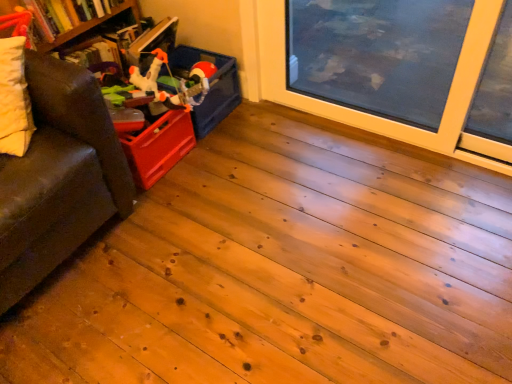
This screenshot has width=512, height=384. What do you see at coordinates (72, 24) in the screenshot?
I see `wooden bookshelf at left` at bounding box center [72, 24].

Identify the location of matte plastic storage box at upper left. The width and height of the screenshot is (512, 384). (210, 86).

Based on the photo, which object is further away from the camera, matte plastic toy at upper left or brown leather couch at left?

matte plastic toy at upper left is further away from the camera.

The image size is (512, 384). What are the coordinates of `studio couch above the matte plastic toy at upper left (from a real-world perspective)` in the screenshot? It's located at (58, 177).

Considering the sizes of matte plastic toy at upper left and brown leather couch at left in the image, is matte plastic toy at upper left bigger or smaller than brown leather couch at left?

Considering their sizes, matte plastic toy at upper left takes up less space than brown leather couch at left.

From a real-world perspective, is matte plastic toy at upper left physically located above or below brown leather couch at left?

matte plastic toy at upper left is below brown leather couch at left.

Would you say matte plastic storage box at upper left is part of brown leather couch at left's contents?

Definitely not — matte plastic storage box at upper left is not inside brown leather couch at left.

Is brown leather couch at left smaller than matte plastic storage box at upper left?

No, brown leather couch at left is not smaller than matte plastic storage box at upper left.

Does brown leather couch at left have a lesser width compared to matte plastic storage box at upper left?

No.

Is brown leather couch at left in front of matte plastic storage box at upper left?

Yes, it is in front of matte plastic storage box at upper left.

Is matte plastic storage box at upper left facing away from wooden bookshelf at left?

Yes, matte plastic storage box at upper left's orientation is away from wooden bookshelf at left.

Which of these two, matte plastic storage box at upper left or wooden bookshelf at left, is wider?

Wider between the two is wooden bookshelf at left.

From the image's perspective, is matte plastic storage box at upper left on top of wooden bookshelf at left?

Incorrect, from the image's perspective, matte plastic storage box at upper left is lower than wooden bookshelf at left.

How different are the orientations of matte plastic storage box at upper left and hardcover book at upper left in degrees?

0.992 degrees separate the facing orientations of matte plastic storage box at upper left and hardcover book at upper left.

Consider the image. Which object is positioned more to the right, matte plastic storage box at upper left or hardcover book at upper left?

matte plastic storage box at upper left is more to the right.

Is matte plastic storage box at upper left looking in the opposite direction of hardcover book at upper left?

No, hardcover book at upper left is not at the back of matte plastic storage box at upper left.

Which of these two, matte plastic storage box at upper left or hardcover book at upper left, is bigger?

hardcover book at upper left.

Is matte plastic toy at upper left inside the boundaries of matte plastic storage box at upper left, or outside?

matte plastic toy at upper left cannot be found inside matte plastic storage box at upper left.

Who is smaller, matte plastic toy at upper left or matte plastic storage box at upper left?

With smaller size is matte plastic storage box at upper left.

Can you confirm if matte plastic toy at upper left is wider than matte plastic storage box at upper left?

In fact, matte plastic toy at upper left might be narrower than matte plastic storage box at upper left.

Is there a large distance between matte plastic toy at upper left and matte plastic storage box at upper left?

That's not correct — matte plastic toy at upper left is a little close to matte plastic storage box at upper left.

Which is behind, point (34, 36) or point (30, 271)?

The point (34, 36) is more distant.

Looking at this image, between wooden bookshelf at left and brown leather couch at left, which one appears on the left side from the viewer's perspective?

Positioned to the left is wooden bookshelf at left.

From a real-world perspective, which object stands above the other?

In real-world perspective, brown leather couch at left is above.

From the image's perspective, between wooden bookshelf at left and brown leather couch at left, who is located below?

brown leather couch at left appears lower in the image.

Locate an element on the screen. This screenshot has height=384, width=512. storage box that is behind the wooden bookshelf at left is located at coordinates (210, 86).

Can you confirm if wooden bookshelf at left is bigger than matte plastic storage box at upper left?

Yes, wooden bookshelf at left is bigger than matte plastic storage box at upper left.

Based on the photo, measure the distance between wooden bookshelf at left and matte plastic storage box at upper left.

The distance of wooden bookshelf at left from matte plastic storage box at upper left is 43.45 centimeters.

From the picture: Considering the sizes of wooden bookshelf at left and matte plastic storage box at upper left in the image, is wooden bookshelf at left taller or shorter than matte plastic storage box at upper left?

In the image, wooden bookshelf at left appears to be taller than matte plastic storage box at upper left.

I want to click on toy on the right of the brown leather couch at left, so click(165, 83).

Locate an element on the screen. The height and width of the screenshot is (384, 512). studio couch above the matte plastic storage box at upper left (from a real-world perspective) is located at coordinates (58, 177).

From the image, which object appears to be nearer to matte plastic storage box at upper left, brown leather couch at left or wooden bookshelf at left?

Among the two, wooden bookshelf at left is located nearer to matte plastic storage box at upper left.

Which object lies nearer to the anchor point brown leather couch at left, matte plastic storage box at upper left or wooden bookshelf at left?

Among the two, matte plastic storage box at upper left is located nearer to brown leather couch at left.

Looking at the image, which one is located closer to matte plastic toy at upper left, wooden bookshelf at left or matte plastic storage box at upper left?

Among the two, matte plastic storage box at upper left is located nearer to matte plastic toy at upper left.

In the scene shown: Which object lies nearer to the anchor point matte plastic toy at upper left, matte plastic storage box at upper left or hardcover book at upper left?

matte plastic storage box at upper left is closer to matte plastic toy at upper left.

Based on their spatial positions, is brown leather couch at left or matte plastic storage box at upper left closer to hardcover book at upper left?

Based on the image, matte plastic storage box at upper left appears to be nearer to hardcover book at upper left.

Estimate the real-world distances between objects in this image. Which object is closer to matte plastic storage box at upper left, hardcover book at upper left or brown leather couch at left?

hardcover book at upper left lies closer to matte plastic storage box at upper left than the other object.

From the image, which object appears to be farther from matte plastic toy at upper left, hardcover book at upper left or brown leather couch at left?

Based on the image, brown leather couch at left appears to be further to matte plastic toy at upper left.

Estimate the real-world distances between objects in this image. Which object is closer to hardcover book at upper left, wooden bookshelf at left or brown leather couch at left?

wooden bookshelf at left is closer to hardcover book at upper left.

This screenshot has width=512, height=384. I want to click on book positioned between brown leather couch at left and matte plastic storage box at upper left from near to far, so click(x=61, y=14).

I want to click on book situated between wooden bookshelf at left and matte plastic toy at upper left from left to right, so click(61, 14).

Where is `bookshelf located between brown leather couch at left and matte plastic storage box at upper left in the depth direction`? The width and height of the screenshot is (512, 384). bookshelf located between brown leather couch at left and matte plastic storage box at upper left in the depth direction is located at coordinates (72, 24).

Locate an element on the screen. book between wooden bookshelf at left and matte plastic storage box at upper left from left to right is located at coordinates (61, 14).